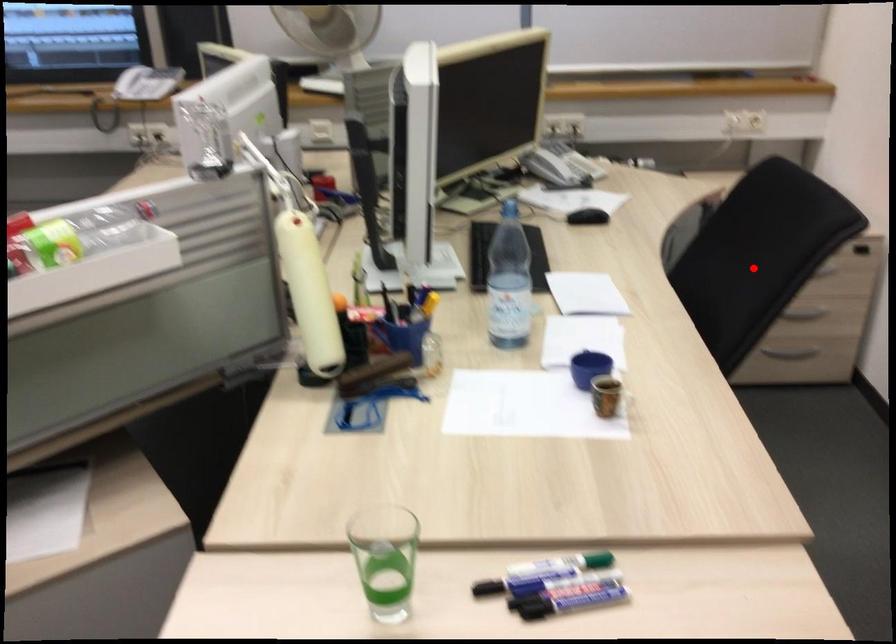
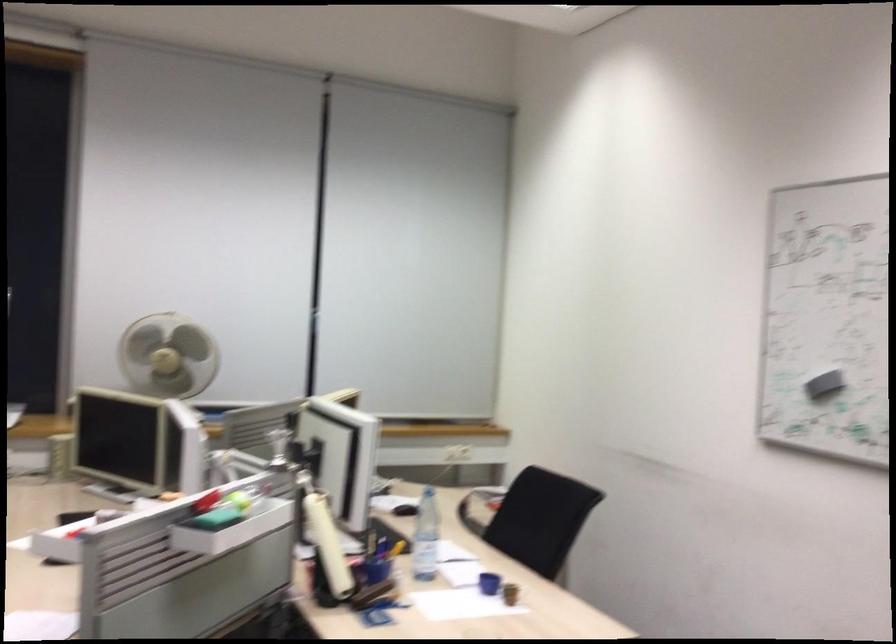
In the second image, find the point that corresponds to the highlighted location in the first image.

(531, 518)